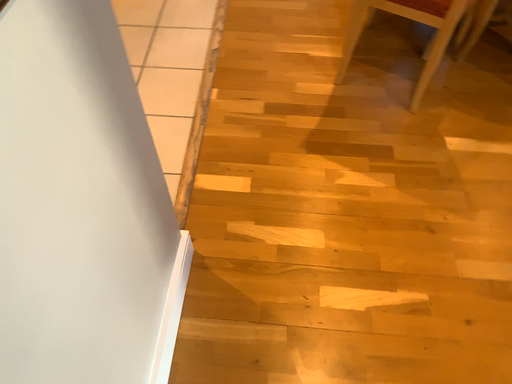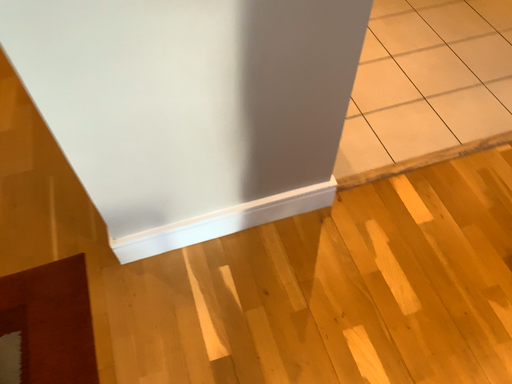
Question: Which way did the camera rotate in the video?

Choices:
 (A) rotated upward
 (B) rotated downward

Answer: (A)